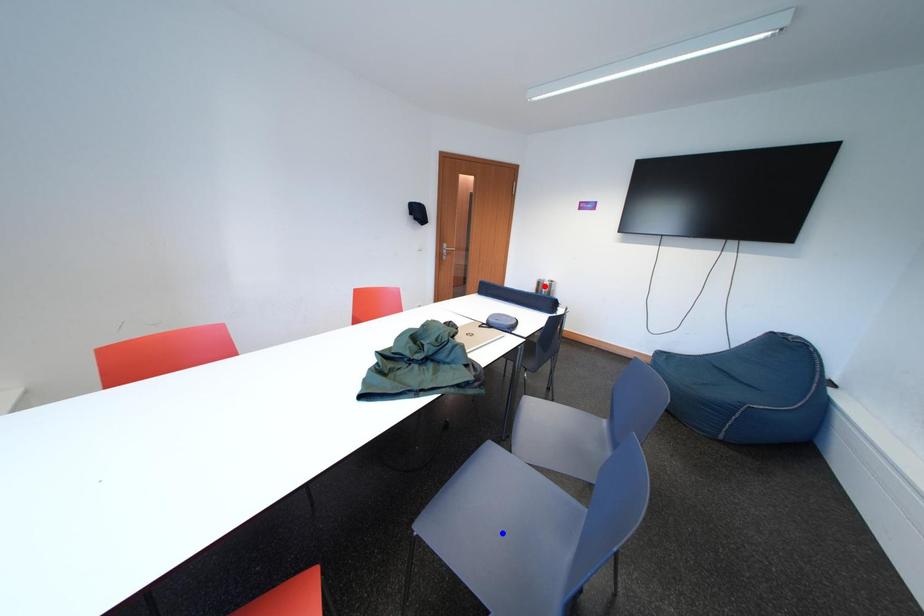
Question: Two points are marked on the image. Which point is closer to the camera?

Choices:
 (A) Blue point is closer.
 (B) Red point is closer.

Answer: (A)